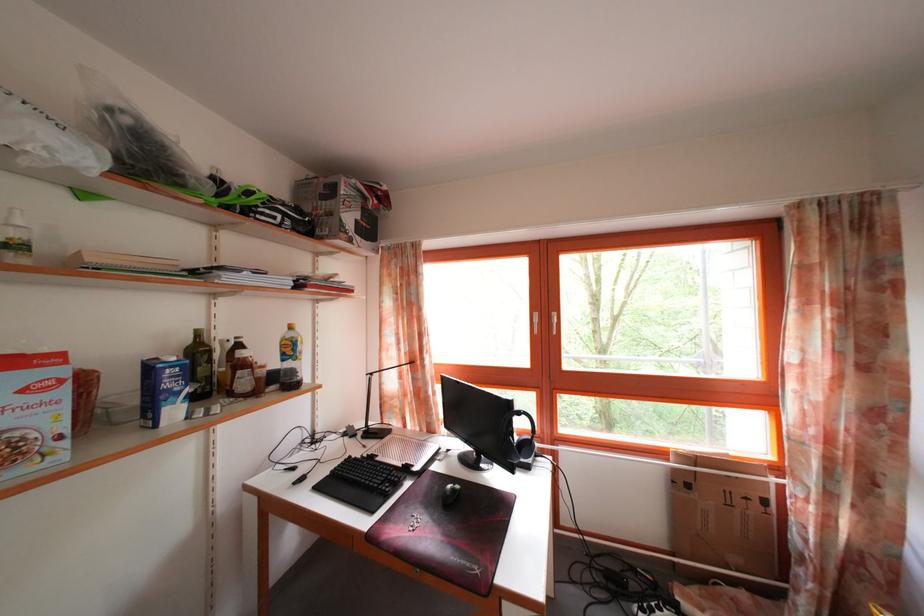
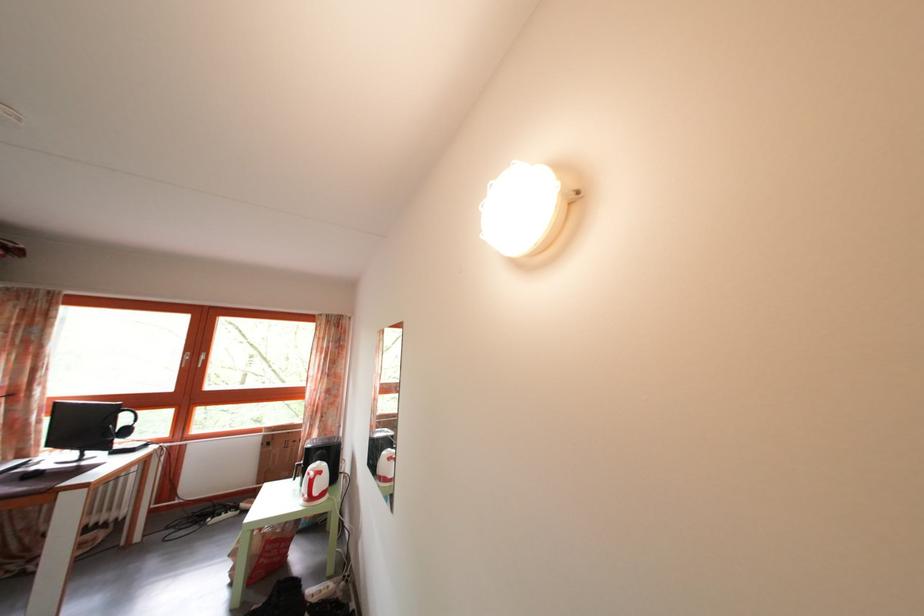
Locate, in the second image, the point that corresponds to (641,578) in the first image.

(233, 514)